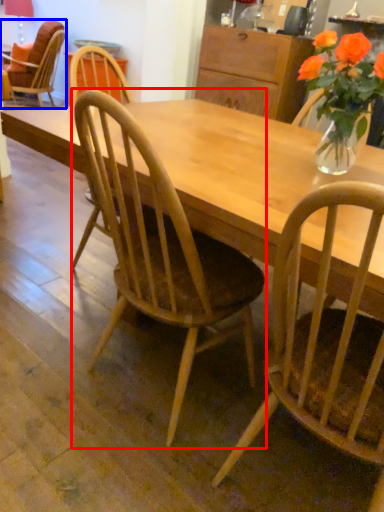
Question: Which of the following is the farthest to the observer, chair (highlighted by a red box) or chair (highlighted by a blue box)?

Choices:
 (A) chair
 (B) chair

Answer: (B)